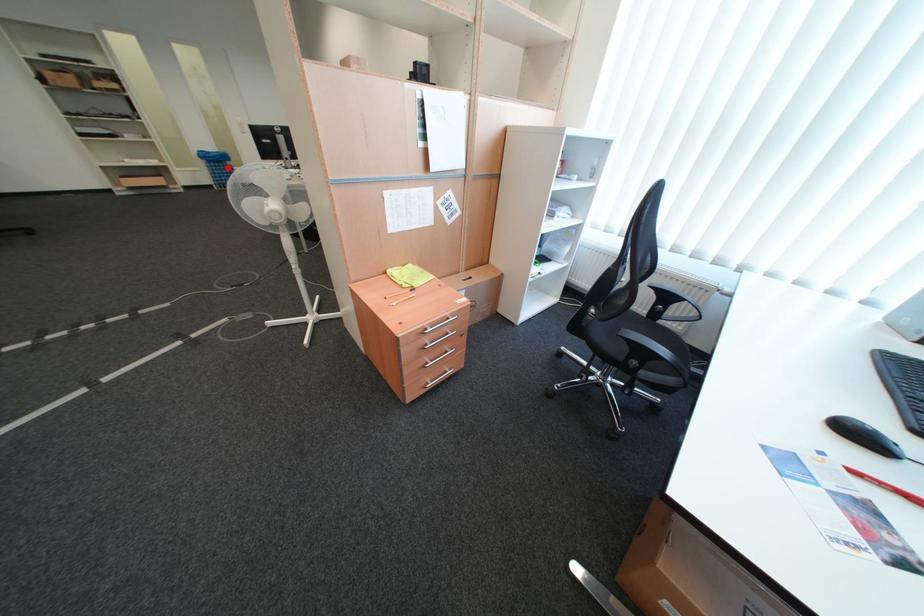
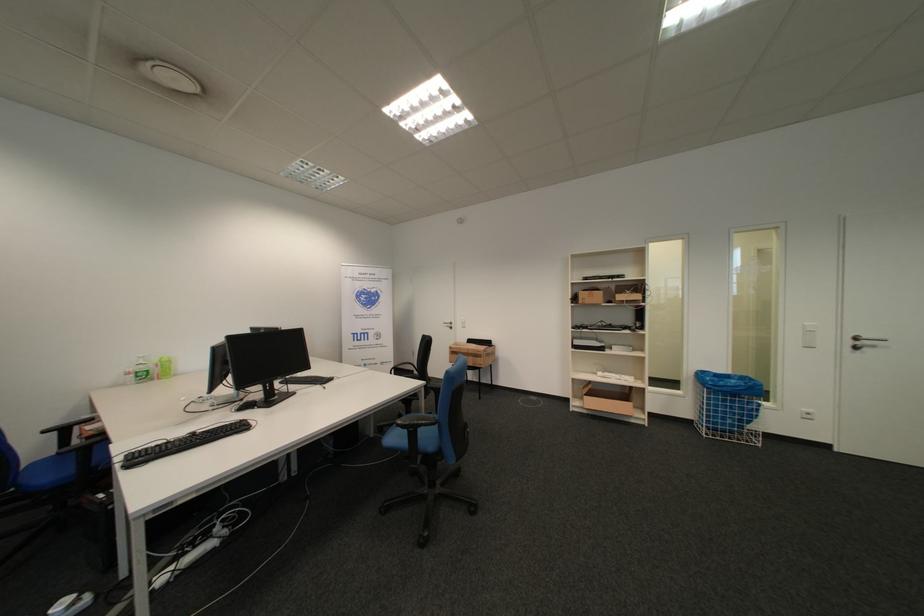
In the second image, find the point that corresponds to the highlighted location in the first image.

(736, 402)